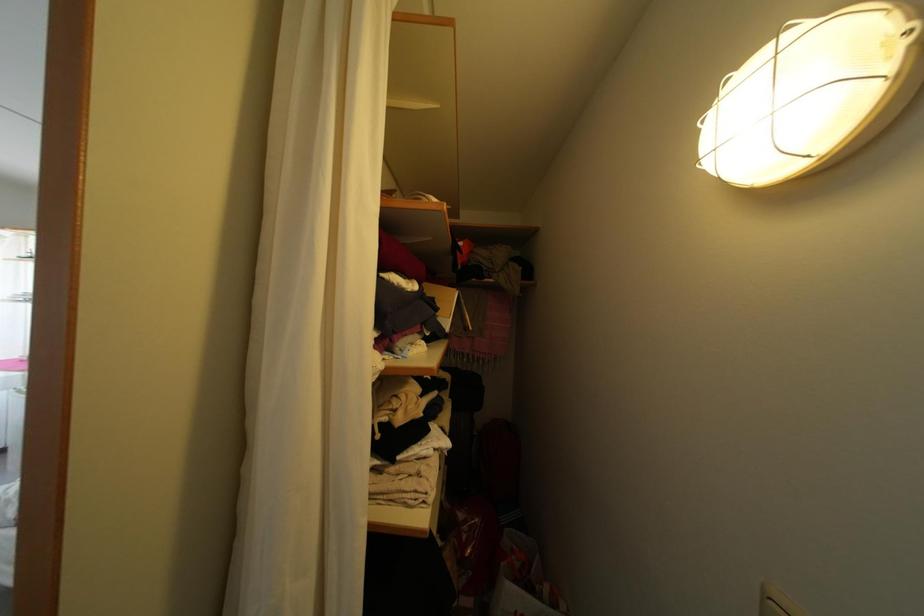
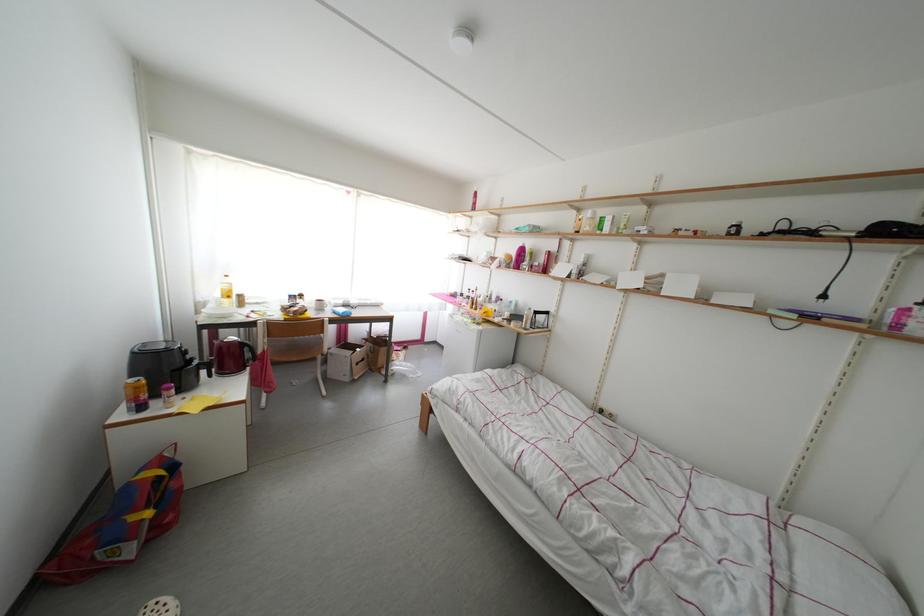
Question: The camera is either moving clockwise (left) or counter-clockwise (right) around the object. The first image is from the beginning of the video and the second image is from the end. Is the camera moving left or right when shooting the video?

Choices:
 (A) Left
 (B) Right

Answer: (B)